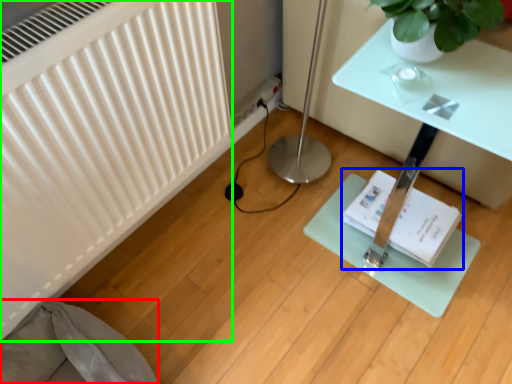
Question: Based on their relative distances, which object is farther from swivel chair (highlighted by a red box)? Choose from book (highlighted by a blue box) and radiator (highlighted by a green box).

Choices:
 (A) book
 (B) radiator

Answer: (A)